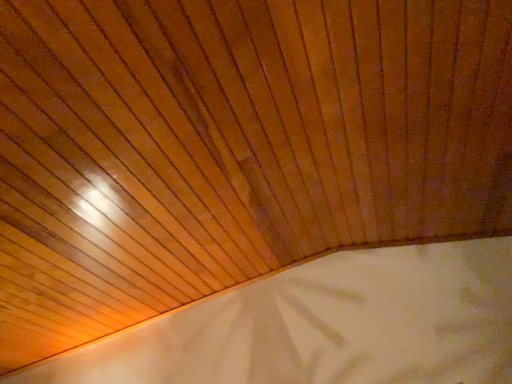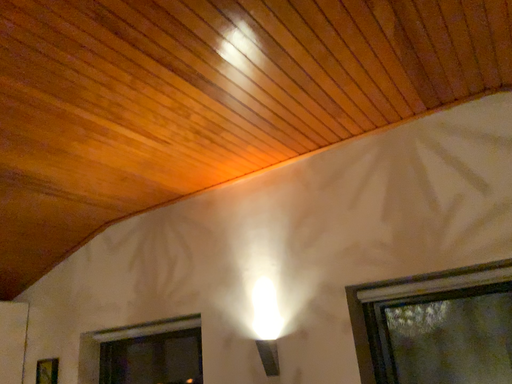
Question: Which way did the camera rotate in the video?

Choices:
 (A) rotated left
 (B) rotated right

Answer: (A)